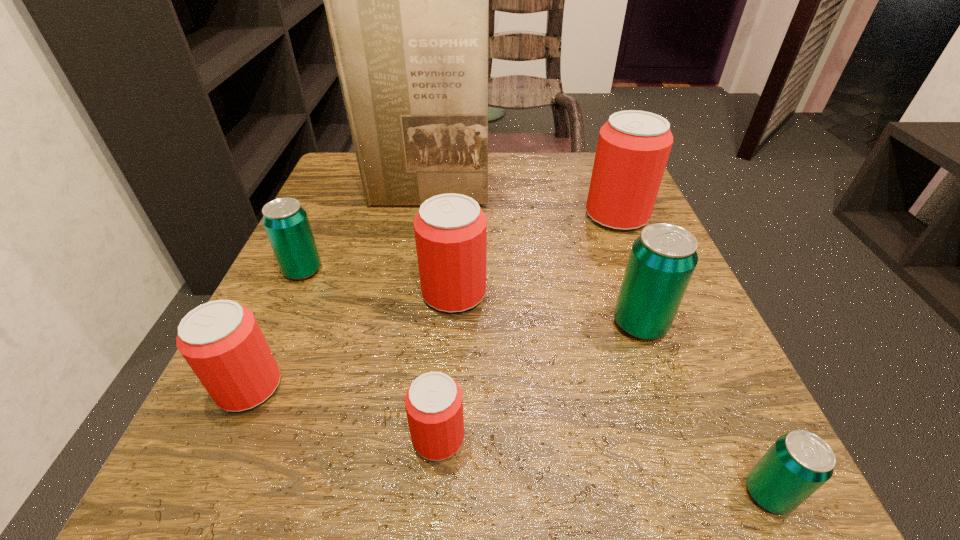
Locate which beer can ranks fourth in proximity to the second farthest teal beer can. Please provide its 2D coordinates. Your answer should be formatted as a tuple, i.e. [(x, y)], where the tuple contains the x and y coordinates of a point satisfying the conditions above.

[(434, 404)]

Locate which beer can is the closest to the nearest beer can. Please provide its 2D coordinates. Your answer should be formatted as a tuple, i.e. [(x, y)], where the tuple contains the x and y coordinates of a point satisfying the conditions above.

[(663, 258)]

Locate an element on the screen. The width and height of the screenshot is (960, 540). red beer can that is the third closest to the farthest beer can is located at coordinates (221, 340).

Locate an element on the screen. the third closest red beer can to the second biggest teal beer can is located at coordinates (434, 404).

Choose which teal beer can is the nearest neighbor to the tallest object. Please provide its 2D coordinates. Your answer should be formatted as a tuple, i.e. [(x, y)], where the tuple contains the x and y coordinates of a point satisfying the conditions above.

[(286, 223)]

Where is `teal beer can that can be found as the third closest to the second farthest red beer can`? teal beer can that can be found as the third closest to the second farthest red beer can is located at coordinates (798, 463).

Where is `free spot that satisfies the following two spatial constraints: 1. on the front side of the second smallest teal beer can; 2. on the left side of the second teal beer can from left to right`? This screenshot has width=960, height=540. free spot that satisfies the following two spatial constraints: 1. on the front side of the second smallest teal beer can; 2. on the left side of the second teal beer can from left to right is located at coordinates (278, 323).

Where is `vacant region that satisfies the following two spatial constraints: 1. on the cover of the smallest red beer can; 2. on the left side of the phonebook`? vacant region that satisfies the following two spatial constraints: 1. on the cover of the smallest red beer can; 2. on the left side of the phonebook is located at coordinates (385, 437).

Where is `vacant area that satisfies the following two spatial constraints: 1. on the cover of the phonebook; 2. on the right side of the tallest beer can`? This screenshot has height=540, width=960. vacant area that satisfies the following two spatial constraints: 1. on the cover of the phonebook; 2. on the right side of the tallest beer can is located at coordinates (422, 215).

You are a GUI agent. You are given a task and a screenshot of the screen. Output one action in this format:
    pyautogui.click(x=<x>, y=<y>)
    Task: Click on the vacant space that satisfies the following two spatial constraints: 1. on the cover of the tallest object; 2. on the right side of the nearest teal beer can
    This screenshot has height=540, width=960.
    Given the screenshot: What is the action you would take?
    pyautogui.click(x=375, y=494)